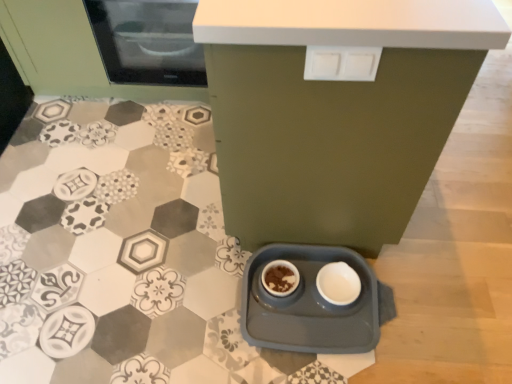
Locate an element on the screen. This screenshot has width=512, height=384. vacant space situated on the left part of white glossy bowl at lower center is located at coordinates (285, 301).